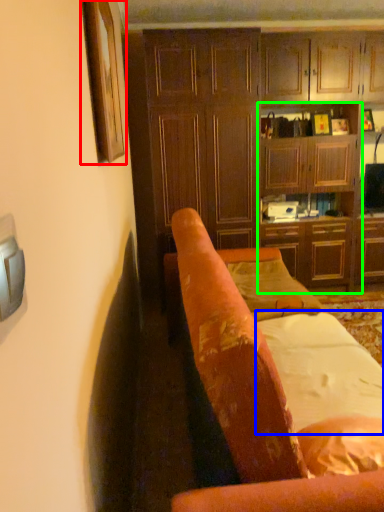
Question: Which is farther away from picture frame (highlighted by a red box)? sheet (highlighted by a blue box) or tv cabinet (highlighted by a green box)?

Choices:
 (A) sheet
 (B) tv cabinet

Answer: (B)